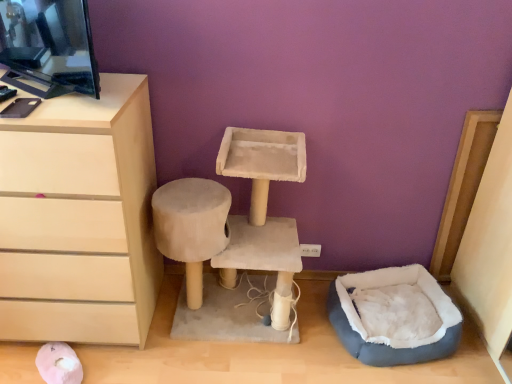
Question: Considering the relative sizes of gray plush bean bag at lower right and beige suede cat tree at center in the image provided, is gray plush bean bag at lower right taller than beige suede cat tree at center?

Choices:
 (A) no
 (B) yes

Answer: (A)

Question: Is gray plush bean bag at lower right not inside beige suede cat tree at center?

Choices:
 (A) no
 (B) yes

Answer: (B)

Question: Is gray plush bean bag at lower right at the right side of beige suede cat tree at center?

Choices:
 (A) yes
 (B) no

Answer: (A)

Question: Is gray plush bean bag at lower right in front of beige suede cat tree at center?

Choices:
 (A) no
 (B) yes

Answer: (A)

Question: From the image's perspective, would you say gray plush bean bag at lower right is shown under beige suede cat tree at center?

Choices:
 (A) yes
 (B) no

Answer: (A)

Question: Would you say beige suede cat tree at center is inside or outside gray plush bean bag at lower right?

Choices:
 (A) inside
 (B) outside

Answer: (B)

Question: From a real-world perspective, is beige suede cat tree at center above or below gray plush bean bag at lower right?

Choices:
 (A) above
 (B) below

Answer: (A)

Question: Is point (268, 137) positioned closer to the camera than point (417, 359)?

Choices:
 (A) closer
 (B) farther

Answer: (A)

Question: In terms of size, does beige suede cat tree at center appear bigger or smaller than gray plush bean bag at lower right?

Choices:
 (A) small
 (B) big

Answer: (B)

Question: Considering the positions of point (150, 278) and point (263, 208), is point (150, 278) closer or farther from the camera than point (263, 208)?

Choices:
 (A) farther
 (B) closer

Answer: (A)

Question: From the image's perspective, is matte beige chest of drawers at left positioned above or below beige suede cat tree at center?

Choices:
 (A) above
 (B) below

Answer: (A)

Question: In terms of height, does matte beige chest of drawers at left look taller or shorter compared to beige suede cat tree at center?

Choices:
 (A) tall
 (B) short

Answer: (A)

Question: Based on their positions, is matte beige chest of drawers at left located to the left or right of beige suede cat tree at center?

Choices:
 (A) left
 (B) right

Answer: (A)

Question: Considering their positions, is gray plush bean bag at lower right located in front of or behind matte beige chest of drawers at left?

Choices:
 (A) front
 (B) behind

Answer: (B)

Question: Is gray plush bean bag at lower right bigger or smaller than matte beige chest of drawers at left?

Choices:
 (A) big
 (B) small

Answer: (B)